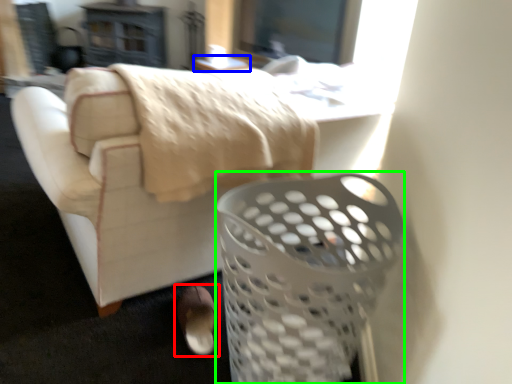
Question: Which object is the farthest from footwear (highlighted by a red box)? Choose among these: table (highlighted by a blue box) or basket (highlighted by a green box).

Choices:
 (A) table
 (B) basket

Answer: (A)